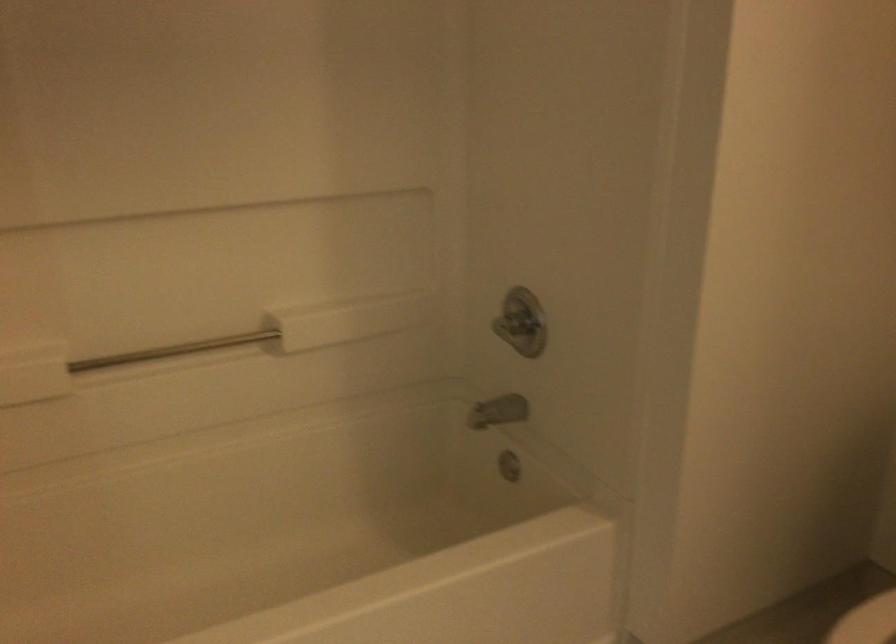
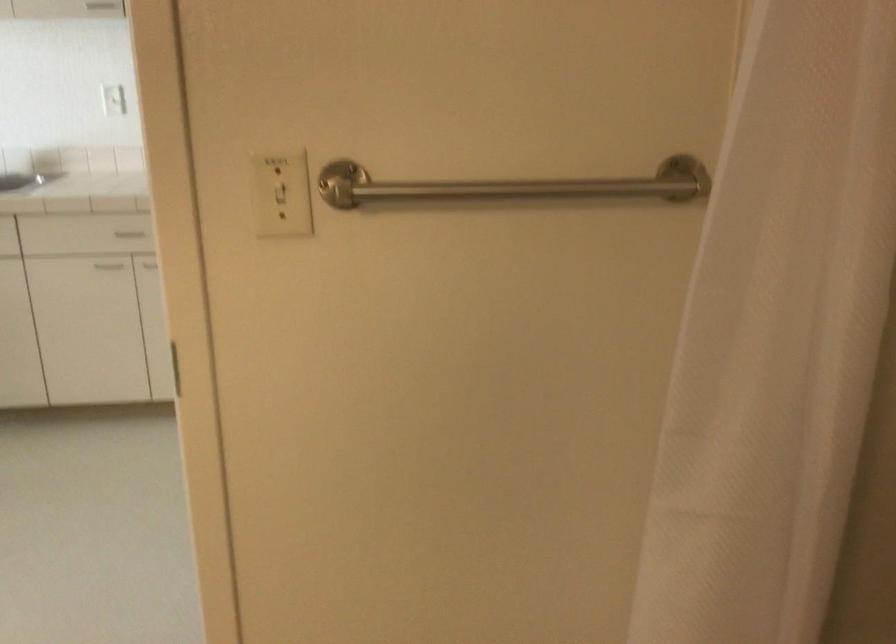
The first image is from the beginning of the video and the second image is from the end. How did the camera likely rotate when shooting the video?

The rotation direction of the camera is left-down.